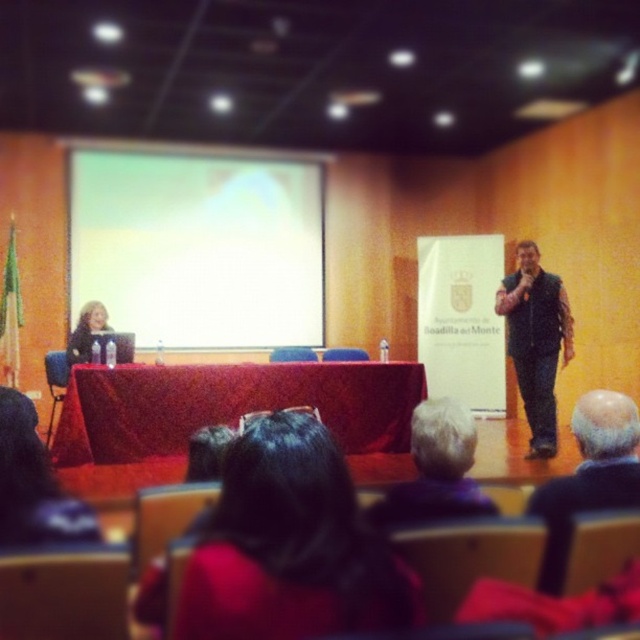
Which is below, white matte projection screen at upper center or dark hair at center?

Positioned lower is dark hair at center.

This screenshot has height=640, width=640. What do you see at coordinates (198, 246) in the screenshot? I see `white matte projection screen at upper center` at bounding box center [198, 246].

At what (x,y) coordinates should I click in order to perform the action: click on white matte projection screen at upper center. Please return your answer as a coordinate pair (x, y). This screenshot has width=640, height=640. Looking at the image, I should click on (198, 246).

Does gray hair at center appear over gray fabric jacket at center?

No.

Which of these two, gray hair at center or gray fabric jacket at center, stands shorter?

gray hair at center is shorter.

In order to click on gray hair at center in this screenshot , I will do `click(436, 468)`.

Which is more to the right, dark hair at center or gray hair at center?

Positioned to the right is gray hair at center.

Is point (189, 636) farther from camera compared to point (435, 428)?

No, (189, 636) is in front of (435, 428).

Locate an element on the screen. This screenshot has width=640, height=640. dark hair at center is located at coordinates (289, 545).